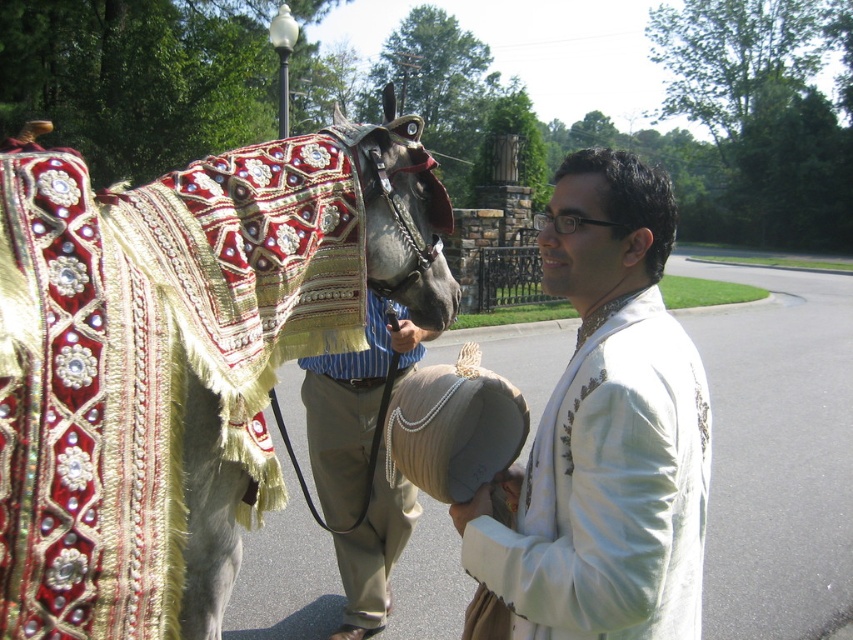
You are trying to decide whether to place a small decorative item on either the shiny gold blanket at left or the white embroidered shirt at center. Based on their sizes, which one has a larger surface area?

The shiny gold blanket at left might be wider than the white embroidered shirt at center, so it likely has a larger surface area.

You are a photographer trying to capture a clear shot of both the shiny gold blanket at left and the white embroidered shirt at center. Based on their sizes, which object should you focus on first to ensure it fits in the frame?

The shiny gold blanket at left is much taller than the white embroidered shirt at center, so you should focus on the shiny gold blanket at left first to ensure it fits in the frame.